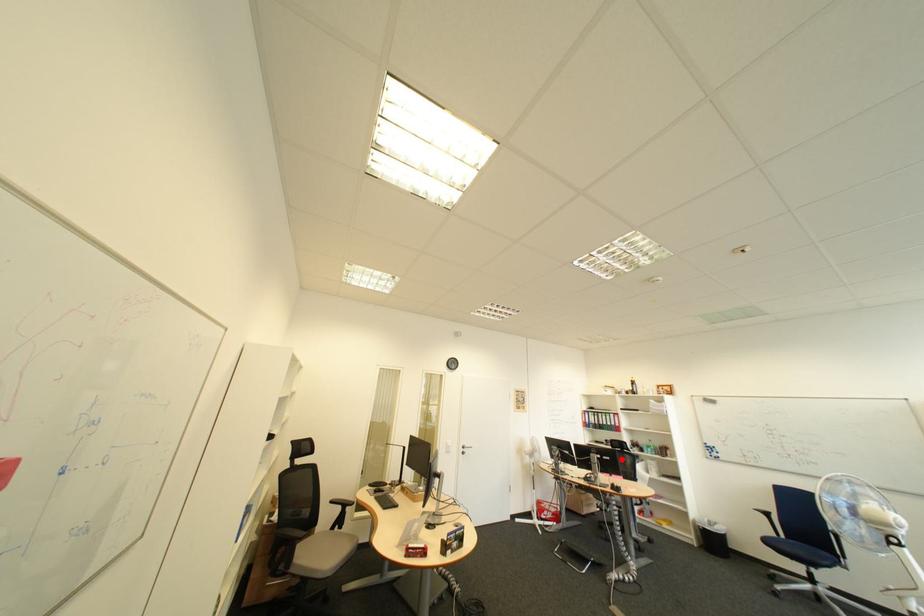
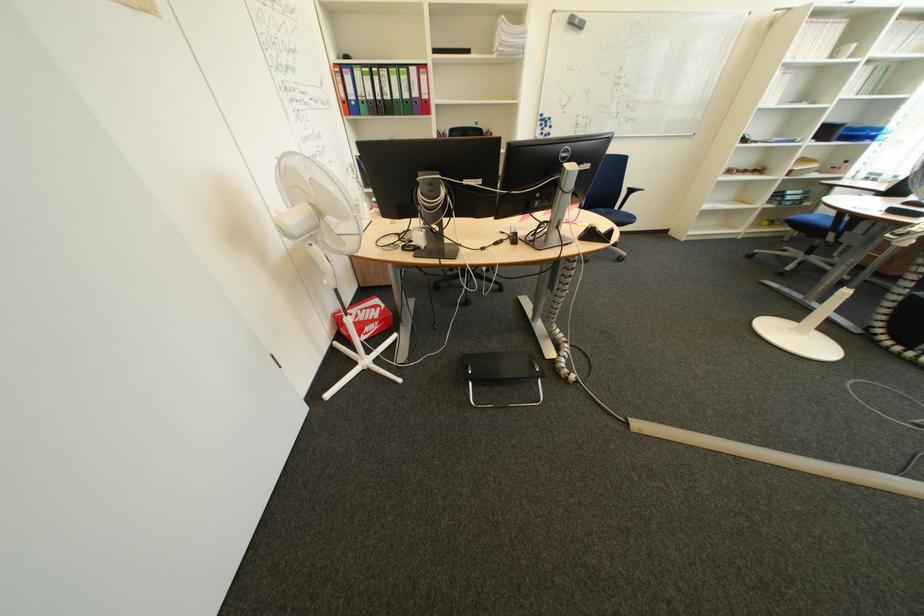
In the second image, find the point that corresponds to the highlighted location in the first image.

(601, 168)